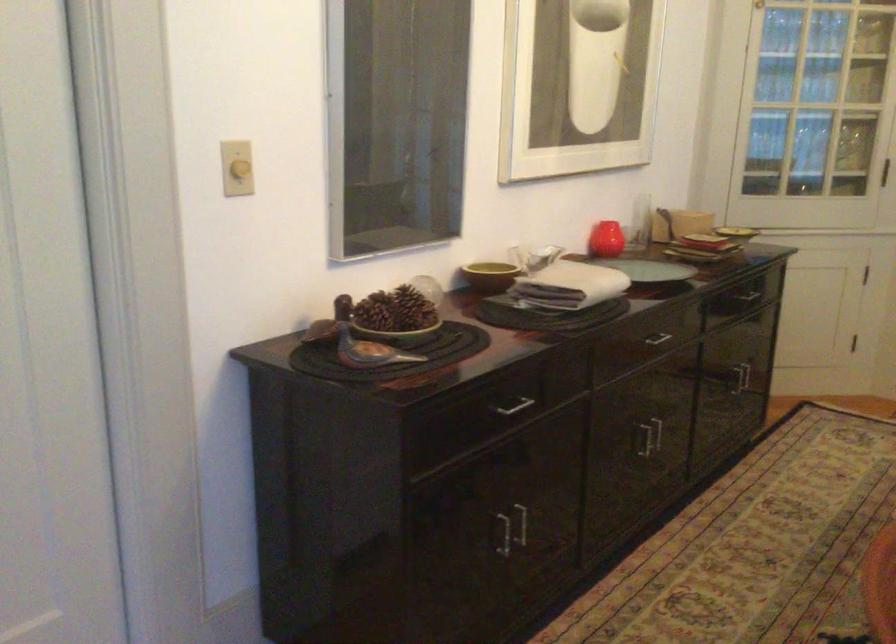
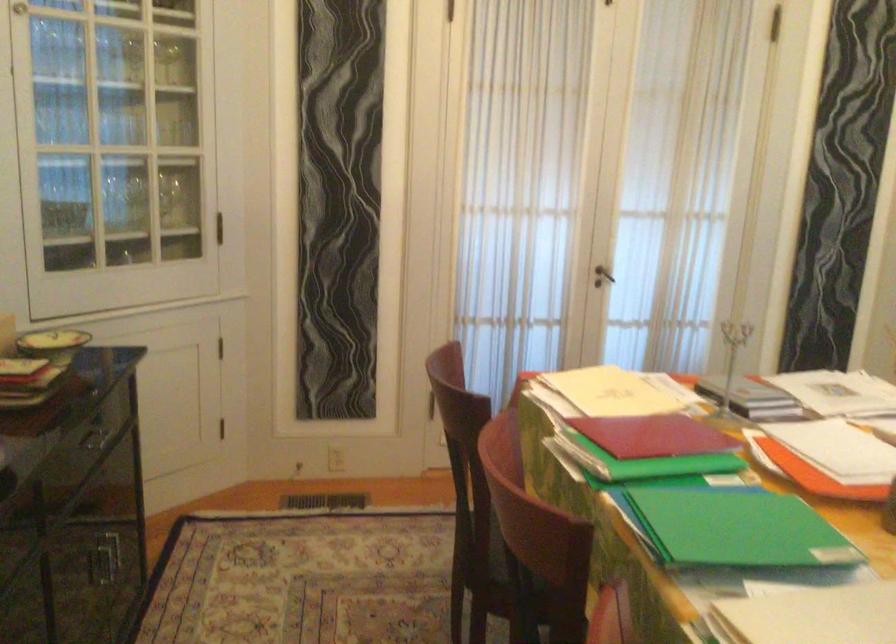
Question: The images are taken continuously from a first-person perspective. In which direction is your viewpoint rotating?

Choices:
 (A) Left
 (B) Right
 (C) Up
 (D) Down

Answer: (B)